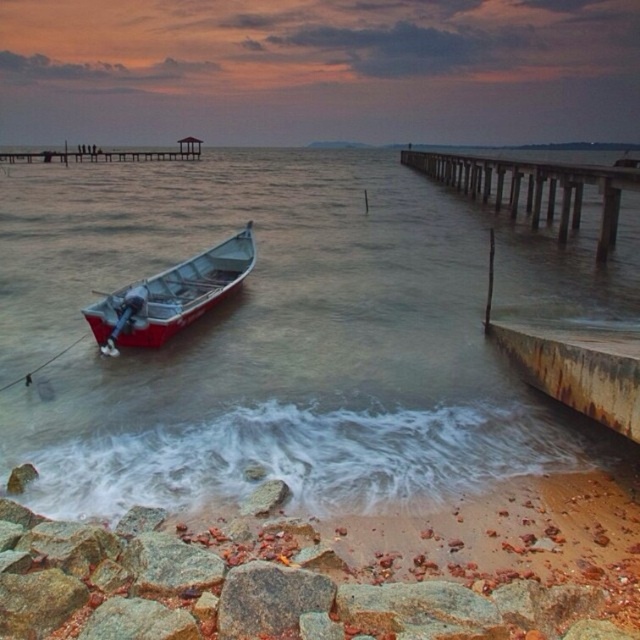
Question: Which of these objects is positioned farthest from the red polished wood boat at left?

Choices:
 (A) clear water at boat left
 (B) wooden pier at right

Answer: (B)

Question: Is clear water at boat left closer to the viewer compared to red polished wood boat at left?

Choices:
 (A) yes
 (B) no

Answer: (A)

Question: Can you confirm if clear water at boat left is positioned below red polished wood boat at left?

Choices:
 (A) yes
 (B) no

Answer: (B)

Question: Which of the following is the closest to the observer?

Choices:
 (A) (513, 202)
 (B) (234, 321)
 (C) (214, 248)

Answer: (B)

Question: Is clear water at boat left wider than red polished wood boat at left?

Choices:
 (A) yes
 (B) no

Answer: (A)

Question: Which point appears farthest from the camera in this image?

Choices:
 (A) (525, 257)
 (B) (580, 204)
 (C) (205, 260)

Answer: (B)